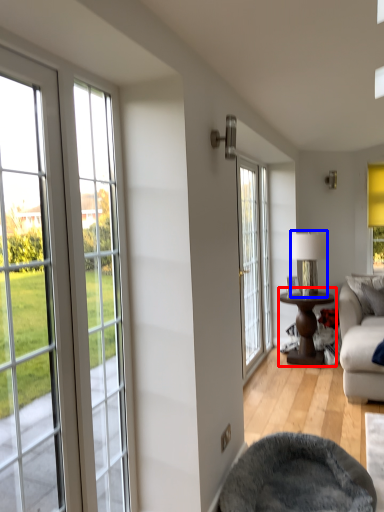
Question: Which of the following is the closest to the observer, table (highlighted by a red box) or lamp (highlighted by a blue box)?

Choices:
 (A) table
 (B) lamp

Answer: (A)